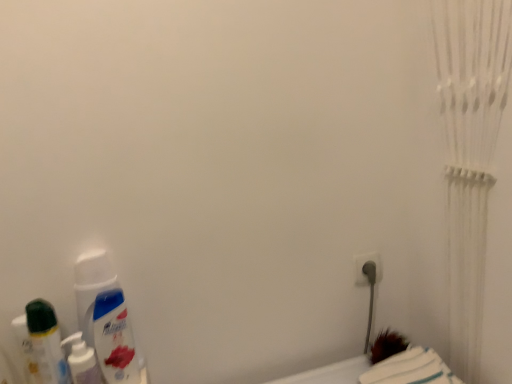
Question: Is translucent plastic mouthwash at lower left, which appears as the first mouthwash when viewed from the left, further to camera compared to white plastic plug at lower right?

Choices:
 (A) no
 (B) yes

Answer: (A)

Question: Is white plastic plug at lower right completely or partially inside translucent plastic mouthwash at lower left, which appears as the first mouthwash when viewed from the left?

Choices:
 (A) no
 (B) yes

Answer: (A)

Question: Is translucent plastic mouthwash at lower left, arranged as the third mouthwash when viewed from the right, looking in the opposite direction of white plastic plug at lower right?

Choices:
 (A) yes
 (B) no

Answer: (B)

Question: Is translucent plastic mouthwash at lower left, which appears as the first mouthwash when viewed from the left, in front of white plastic plug at lower right?

Choices:
 (A) yes
 (B) no

Answer: (A)

Question: Is translucent plastic mouthwash at lower left, which appears as the first mouthwash when viewed from the left, touching white plastic plug at lower right?

Choices:
 (A) yes
 (B) no

Answer: (B)

Question: Would you say translucent plastic mouthwash at lower left, which appears as the first mouthwash when viewed from the left, is outside white plastic plug at lower right?

Choices:
 (A) yes
 (B) no

Answer: (A)

Question: Can you see white glossy mouthwash at lower left, which appears as the third mouthwash when viewed from the left, touching translucent plastic mouthwash at lower left, which appears as the first mouthwash when viewed from the left?

Choices:
 (A) yes
 (B) no

Answer: (A)

Question: Does white glossy mouthwash at lower left, which appears as the third mouthwash when viewed from the left, lie behind translucent plastic mouthwash at lower left, arranged as the third mouthwash when viewed from the right?

Choices:
 (A) no
 (B) yes

Answer: (B)

Question: Is white glossy mouthwash at lower left, which ranks as the 1th mouthwash in right-to-left order, thinner than translucent plastic mouthwash at lower left, arranged as the third mouthwash when viewed from the right?

Choices:
 (A) no
 (B) yes

Answer: (B)

Question: From a real-world perspective, does white glossy mouthwash at lower left, which appears as the third mouthwash when viewed from the left, sit lower than translucent plastic mouthwash at lower left, arranged as the third mouthwash when viewed from the right?

Choices:
 (A) yes
 (B) no

Answer: (A)

Question: Could you tell me if white glossy mouthwash at lower left, which appears as the third mouthwash when viewed from the left, is facing translucent plastic mouthwash at lower left, arranged as the third mouthwash when viewed from the right?

Choices:
 (A) no
 (B) yes

Answer: (A)

Question: Is white glossy mouthwash at lower left, which appears as the third mouthwash when viewed from the left, far from translucent plastic mouthwash at lower left, which appears as the first mouthwash when viewed from the left?

Choices:
 (A) yes
 (B) no

Answer: (B)

Question: Can you confirm if white plastic plug at lower right is positioned to the right of white soft towel at lower right?

Choices:
 (A) yes
 (B) no

Answer: (B)